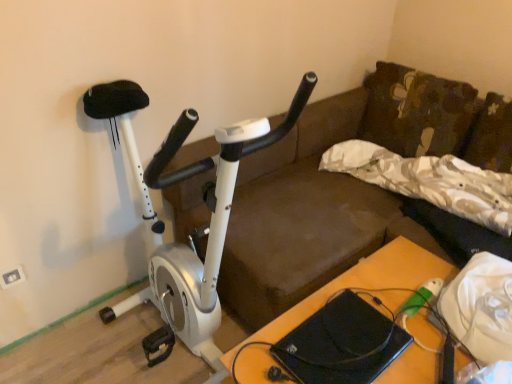
You are a GUI agent. You are given a task and a screenshot of the screen. Output one action in this format:
    pyautogui.click(x=<x>, y=<y>)
    Task: Click on the free space above wooden table at lower right (from a real-world perspective)
    
    Given the screenshot: What is the action you would take?
    pyautogui.click(x=384, y=313)